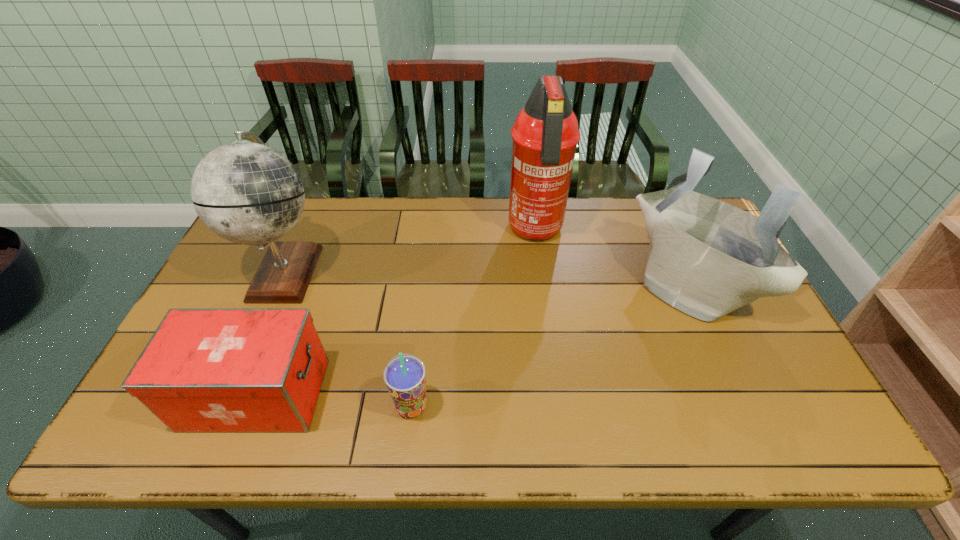
Locate an element on the screen. free space between the fourth object from left to right and the first-aid kit is located at coordinates (396, 313).

At what (x,y) coordinates should I click in order to perform the action: click on free space between the rightmost object and the second object from right to left. Please return your answer as a coordinate pair (x, y). This screenshot has height=540, width=960. Looking at the image, I should click on (612, 258).

You are a GUI agent. You are given a task and a screenshot of the screen. Output one action in this format:
    pyautogui.click(x=<x>, y=<y>)
    Task: Click on the free space between the fire extinguisher and the shopping bag
    
    Given the screenshot: What is the action you would take?
    pyautogui.click(x=612, y=258)

Find the location of a particular element. This screenshot has height=540, width=960. object that is the second nearest to the third object from left to right is located at coordinates (246, 192).

Point out which object is positioned as the third nearest to the globe. Please provide its 2D coordinates. Your answer should be formatted as a tuple, i.e. [(x, y)], where the tuple contains the x and y coordinates of a point satisfying the conditions above.

[(545, 135)]

The image size is (960, 540). I want to click on free space that satisfies the following two spatial constraints: 1. on the back side of the smoothie; 2. at the equator of the globe, so click(x=427, y=271).

You are a GUI agent. You are given a task and a screenshot of the screen. Output one action in this format:
    pyautogui.click(x=<x>, y=<y>)
    Task: Click on the blank area in the image that satisfies the following two spatial constraints: 1. on the trigger side of the second object from right to left; 2. at the equator of the globe
    
    Given the screenshot: What is the action you would take?
    pyautogui.click(x=541, y=271)

Identify the location of vacant region that satisfies the following two spatial constraints: 1. at the equator of the globe; 2. on the back side of the shopping bag. (280, 284).

You are a GUI agent. You are given a task and a screenshot of the screen. Output one action in this format:
    pyautogui.click(x=<x>, y=<y>)
    Task: Click on the free space that satisfies the following two spatial constraints: 1. on the handle side of the third object from right to left; 2. on the left side of the first-aid kit
    This screenshot has width=960, height=540.
    Given the screenshot: What is the action you would take?
    pyautogui.click(x=251, y=406)

Locate an element on the screen. vacant space that satisfies the following two spatial constraints: 1. on the trigger side of the fire extinguisher; 2. on the handle side of the first-aid kit is located at coordinates (558, 394).